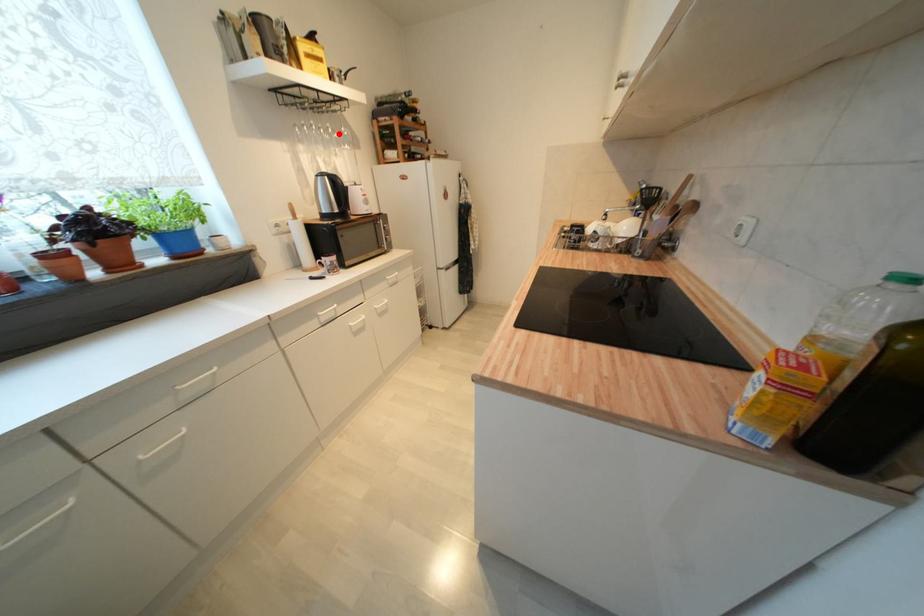
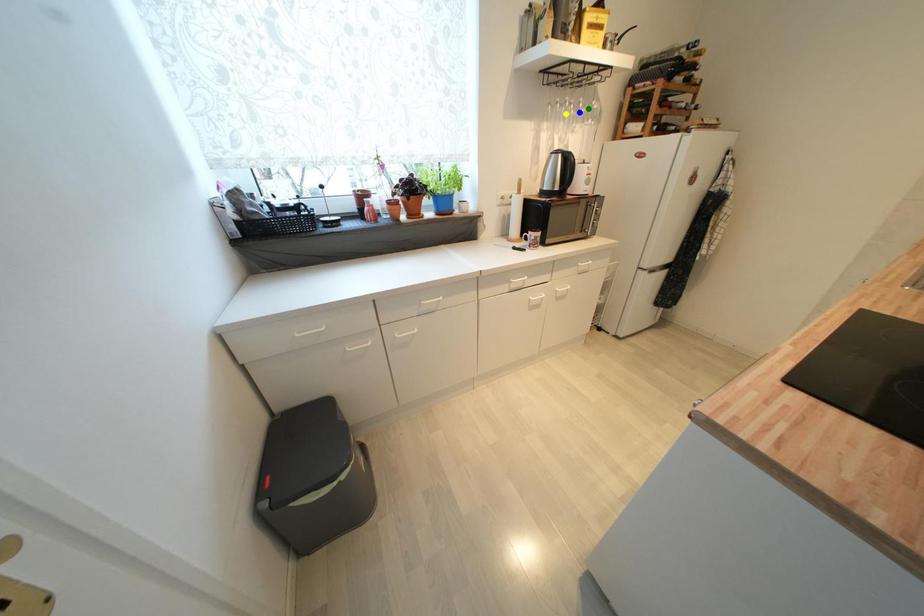
Question: I am providing you with two images of the same scene from different viewpoints. A red point is marked on the first image. You are given multiple points on the second image. Which mark in image 2 goes with the point in image 1?

Choices:
 (A) blue point
 (B) green point
 (C) yellow point

Answer: (B)